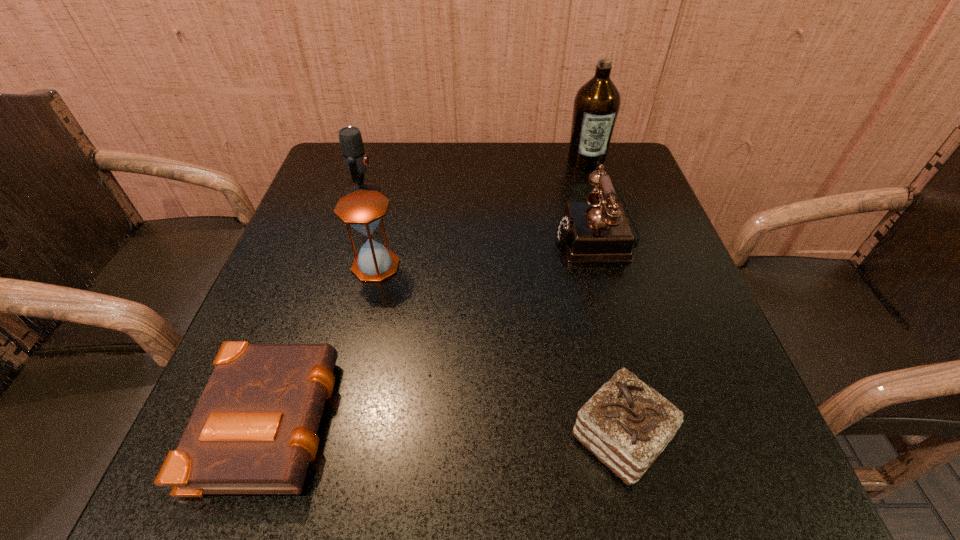
This screenshot has width=960, height=540. What are the coordinates of `vacant space located 0.280m on the dial of the telephone` in the screenshot? It's located at (426, 237).

At what (x,y) coordinates should I click in order to perform the action: click on blank area located on the dial of the telephone. Please return your answer as a coordinate pair (x, y). Image resolution: width=960 pixels, height=540 pixels. Looking at the image, I should click on (407, 237).

Where is `vacant space located on the dial of the telephone`? vacant space located on the dial of the telephone is located at coordinates (495, 237).

The width and height of the screenshot is (960, 540). In order to click on vacant space located on the back of the chocolate cake in this screenshot , I will do `click(580, 258)`.

This screenshot has width=960, height=540. In order to click on free space located on the spine side of the Bible in this screenshot , I will do coord(511,415).

At what (x,y) coordinates should I click in order to perform the action: click on olive oil that is positioned at the far edge. Please return your answer as a coordinate pair (x, y). Looking at the image, I should click on (596, 106).

Identify the location of microphone present at the far edge. (355, 159).

The image size is (960, 540). In order to click on chocolate cake located at the near edge in this screenshot , I will do `click(626, 424)`.

Where is `Bible present at the near edge`? Bible present at the near edge is located at coordinates (254, 429).

You are a GUI agent. You are given a task and a screenshot of the screen. Output one action in this format:
    pyautogui.click(x=<x>, y=<y>)
    Task: Click on the microphone located in the left edge section of the desktop
    The image size is (960, 540).
    Given the screenshot: What is the action you would take?
    pyautogui.click(x=355, y=159)